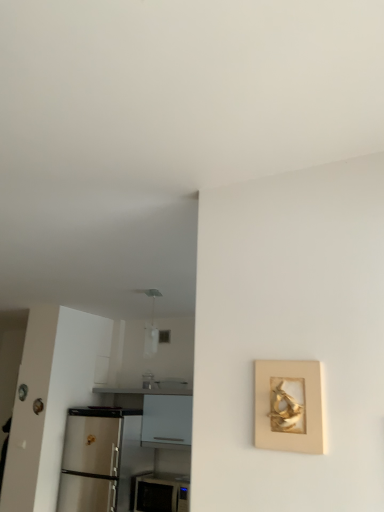
Identify the location of white glossy counter at lower left. The height and width of the screenshot is (512, 384). (159, 414).

What do you see at coordinates (161, 493) in the screenshot?
I see `white glossy microwave at lower center` at bounding box center [161, 493].

Measure the distance between white glossy microwave at lower center and camera.

The depth of white glossy microwave at lower center is 3.34 meters.

Where is `gold textured frame at right`? The image size is (384, 512). gold textured frame at right is located at coordinates (289, 406).

From a real-world perspective, who is located higher, gold textured frame at right or white glossy counter at lower left?

gold textured frame at right.

Does gold textured frame at right appear on the left side of white glossy counter at lower left?

In fact, gold textured frame at right is to the right of white glossy counter at lower left.

Locate an element on the screen. counter that appears below the gold textured frame at right (from the image's perspective) is located at coordinates (159, 414).

Consider the image. Is white glossy counter at lower left positioned before gold textured frame at right?

No, white glossy counter at lower left is further to the viewer.

From the image's perspective, is white glossy counter at lower left on top of gold textured frame at right?

No, from the image's perspective, white glossy counter at lower left is not on top of gold textured frame at right.

Can we say white glossy microwave at lower center lies outside white glossy counter at lower left?

white glossy microwave at lower center lies outside white glossy counter at lower left's area.

Locate an element on the screen. Image resolution: width=384 pixels, height=512 pixels. counter that appears above the white glossy microwave at lower center (from a real-world perspective) is located at coordinates (159, 414).

From a real-world perspective, is white glossy microwave at lower center under white glossy counter at lower left?

Yes.

Is white glossy microwave at lower center placed right next to white glossy counter at lower left?

No, white glossy microwave at lower center is not beside white glossy counter at lower left.

Is white glossy microwave at lower center touching gold textured frame at right?

white glossy microwave at lower center is not next to gold textured frame at right, and they're not touching.

Does white glossy microwave at lower center appear on the right side of gold textured frame at right?

In fact, white glossy microwave at lower center is to the left of gold textured frame at right.

Which object is more forward, white glossy microwave at lower center or gold textured frame at right?

gold textured frame at right is closer to the camera.

Is white glossy microwave at lower center looking in the opposite direction of gold textured frame at right?

That's not correct — white glossy microwave at lower center is not looking away from gold textured frame at right.

Considering the sizes of white glossy counter at lower left and white glossy microwave at lower center in the image, is white glossy counter at lower left taller or shorter than white glossy microwave at lower center?

Considering their sizes, white glossy counter at lower left has more height than white glossy microwave at lower center.

From the image's perspective, between white glossy counter at lower left and white glossy microwave at lower center, which one is located above?

white glossy counter at lower left is shown above in the image.

From a real-world perspective, between white glossy counter at lower left and white glossy microwave at lower center, who is vertically lower?

white glossy microwave at lower center, from a real-world perspective.

Considering the positions of objects white glossy counter at lower left and white glossy microwave at lower center in the image provided, who is more to the right, white glossy counter at lower left or white glossy microwave at lower center?

Positioned to the right is white glossy microwave at lower center.

Can you confirm if gold textured frame at right is positioned to the left of white glossy microwave at lower center?

No, gold textured frame at right is not to the left of white glossy microwave at lower center.

Does gold textured frame at right lie in front of white glossy microwave at lower center?

Yes, it is in front of white glossy microwave at lower center.

Considering the relative sizes of gold textured frame at right and white glossy microwave at lower center in the image provided, is gold textured frame at right thinner than white glossy microwave at lower center?

Indeed, gold textured frame at right has a lesser width compared to white glossy microwave at lower center.

Considering the positions of point (310, 375) and point (143, 488), is point (310, 375) closer or farther from the camera than point (143, 488)?

Clearly, point (310, 375) is closer to the camera than point (143, 488).

You are a GUI agent. You are given a task and a screenshot of the screen. Output one action in this format:
    pyautogui.click(x=<x>, y=<y>)
    Task: Click on the picture frame on the right side of white glossy counter at lower left
    The width and height of the screenshot is (384, 512).
    Given the screenshot: What is the action you would take?
    pyautogui.click(x=289, y=406)

Locate an element on the screen. The height and width of the screenshot is (512, 384). counter that is below the gold textured frame at right (from the image's perspective) is located at coordinates (159, 414).

From the image, which object appears to be nearer to white glossy microwave at lower center, white glossy counter at lower left or gold textured frame at right?

Based on the image, white glossy counter at lower left appears to be nearer to white glossy microwave at lower center.

Which object lies nearer to the anchor point gold textured frame at right, white glossy counter at lower left or white glossy microwave at lower center?

white glossy microwave at lower center lies closer to gold textured frame at right than the other object.

Estimate the real-world distances between objects in this image. Which object is closer to white glossy counter at lower left, gold textured frame at right or white glossy microwave at lower center?

white glossy microwave at lower center is closer to white glossy counter at lower left.

When comparing their distances from gold textured frame at right, does white glossy microwave at lower center or white glossy counter at lower left seem closer?

Among the two, white glossy microwave at lower center is located nearer to gold textured frame at right.

Considering their positions, is white glossy microwave at lower center positioned closer to white glossy counter at lower left than gold textured frame at right?

white glossy microwave at lower center.

Based on their spatial positions, is gold textured frame at right or white glossy counter at lower left further from white glossy microwave at lower center?

The object further to white glossy microwave at lower center is gold textured frame at right.

The height and width of the screenshot is (512, 384). In order to click on appliance positioned between gold textured frame at right and white glossy counter at lower left from near to far in this screenshot , I will do `click(161, 493)`.